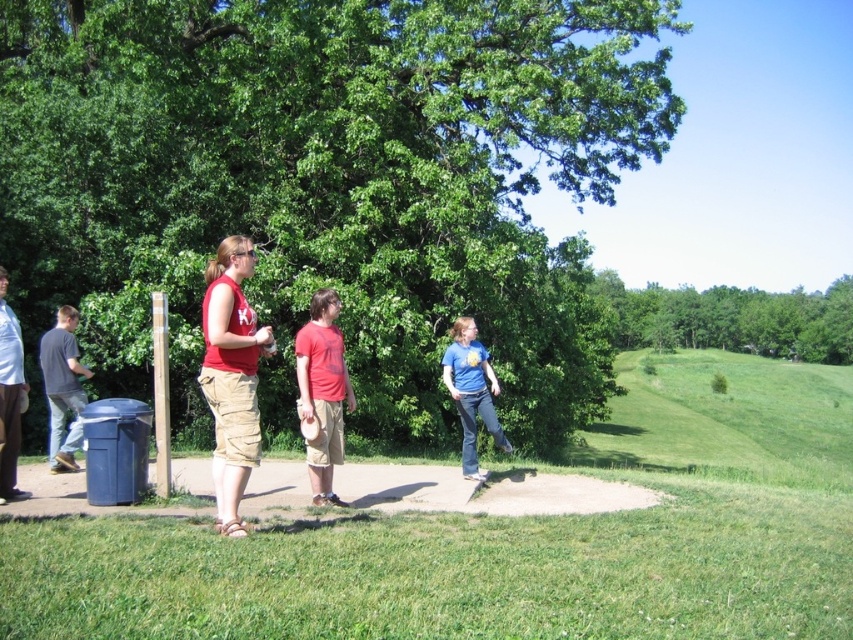
In the park scene, there are a green leafy tree at center and a matte red tank top at center. Which object is positioned to the right of the other?

The green leafy tree at center is to the right of the matte red tank top at center.

You are standing at the point with coordinates point (329,186) in the park scene. What object are you located on?

You are located on the green leafy tree at center.

You are standing at the origin point of the park scene. You need to locate the matte red tank top at center. Which direction should you move to reach it?

The matte red tank top at center is located at point 0.588 on the x axis and 0.272 on the y axis. Since you are at the origin, you should move right along the x axis and forward along the y axis to reach it.